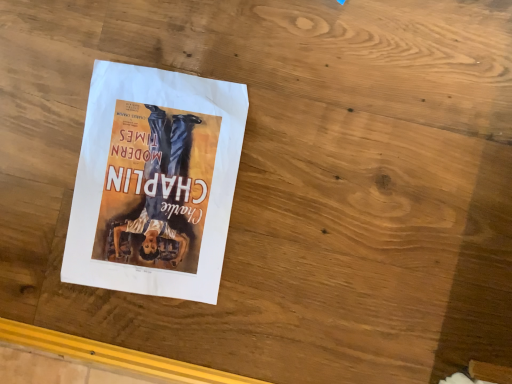
What do you see at coordinates (155, 182) in the screenshot? I see `white paper poster at center` at bounding box center [155, 182].

Identify the location of white paper poster at center. The height and width of the screenshot is (384, 512). (155, 182).

I want to click on white paper poster at center, so click(x=155, y=182).